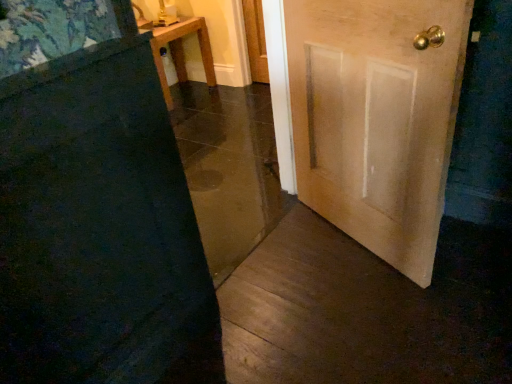
Question: Does wooden table at upper left have a lesser width compared to light brown wooden door at right, the second door viewed from the left?

Choices:
 (A) yes
 (B) no

Answer: (B)

Question: Does wooden table at upper left have a larger size compared to light brown wooden door at right, which is the 1th door in right-to-left order?

Choices:
 (A) yes
 (B) no

Answer: (A)

Question: Is wooden table at upper left oriented towards light brown wooden door at right, which is the 1th door in right-to-left order?

Choices:
 (A) yes
 (B) no

Answer: (A)

Question: Are wooden table at upper left and light brown wooden door at right, the second door viewed from the left, making contact?

Choices:
 (A) yes
 (B) no

Answer: (B)

Question: Is wooden table at upper left positioned beyond the bounds of light brown wooden door at right, which is the 1th door in right-to-left order?

Choices:
 (A) no
 (B) yes

Answer: (B)

Question: Is wooden table at upper left positioned behind light brown wooden door at right, which is the 1th door in right-to-left order?

Choices:
 (A) yes
 (B) no

Answer: (A)

Question: Does light brown wooden door at right, which is the 1th door in right-to-left order, lie in front of wooden door at center, marked as the 2th door in a right-to-left arrangement?

Choices:
 (A) no
 (B) yes

Answer: (A)

Question: Is light brown wooden door at right, which is the 1th door in right-to-left order, aimed at wooden door at center, marked as the 2th door in a right-to-left arrangement?

Choices:
 (A) yes
 (B) no

Answer: (A)

Question: Considering the relative sizes of light brown wooden door at right, which is the 1th door in right-to-left order, and wooden door at center, the 1th door in the left-to-right sequence, in the image provided, is light brown wooden door at right, which is the 1th door in right-to-left order, thinner than wooden door at center, the 1th door in the left-to-right sequence,?

Choices:
 (A) no
 (B) yes

Answer: (A)

Question: From a real-world perspective, is light brown wooden door at right, which is the 1th door in right-to-left order, positioned over wooden door at center, the 1th door in the left-to-right sequence, based on gravity?

Choices:
 (A) no
 (B) yes

Answer: (A)

Question: Is light brown wooden door at right, the second door viewed from the left, positioned far away from wooden door at center, the 1th door in the left-to-right sequence?

Choices:
 (A) no
 (B) yes

Answer: (A)

Question: Can you confirm if light brown wooden door at right, which is the 1th door in right-to-left order, is wider than wooden door at center, the 1th door in the left-to-right sequence?

Choices:
 (A) yes
 (B) no

Answer: (A)

Question: Is wooden door at center, the 1th door in the left-to-right sequence, looking in the opposite direction of light brown wooden door at right, the second door viewed from the left?

Choices:
 (A) no
 (B) yes

Answer: (A)